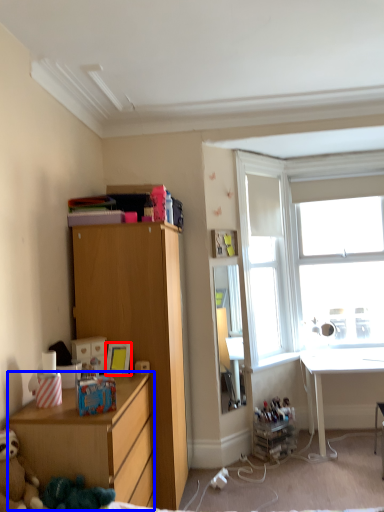
Question: Among these objects, which one is nearest to the camera, picture frame (highlighted by a red box) or chest of drawers (highlighted by a blue box)?

Choices:
 (A) picture frame
 (B) chest of drawers

Answer: (B)